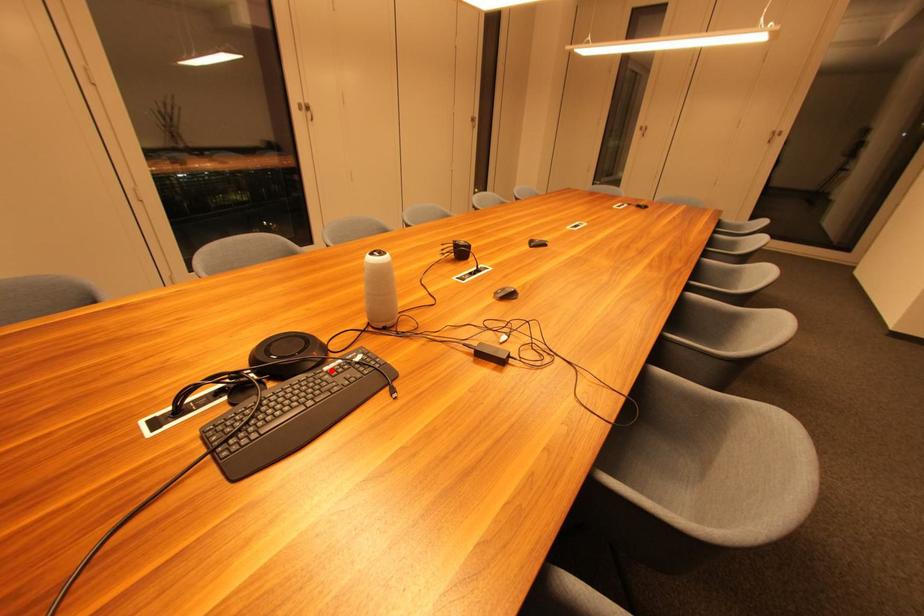
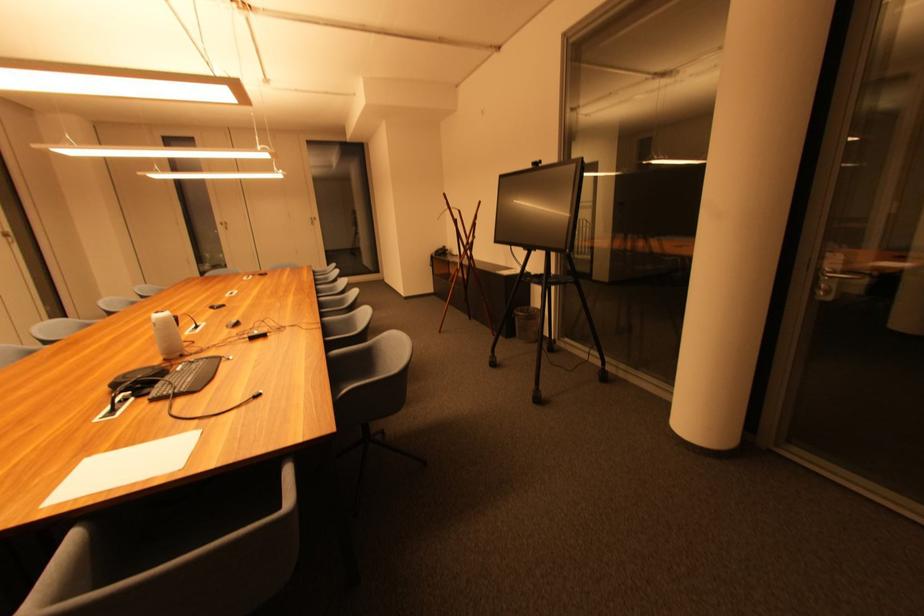
Where in the second image is the point corresponding to the highlighted location from the first image?

(184, 371)